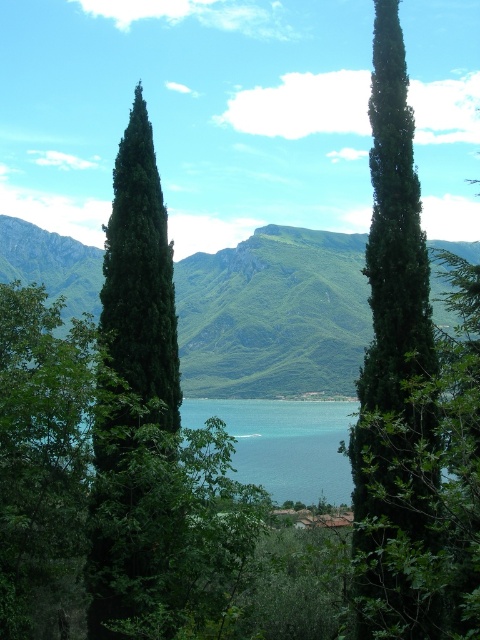
Question: Which object is positioned farthest from the green glossy cypress at center?

Choices:
 (A) green leafy mountain at center
 (B) green matte tree at center

Answer: (A)

Question: Which of the following is the farthest from the observer?

Choices:
 (A) (189, 394)
 (B) (423, 342)

Answer: (A)

Question: Can you confirm if green glossy cypress at center is positioned to the right of green matte tree at center?

Choices:
 (A) no
 (B) yes

Answer: (B)

Question: Observing the image, what is the correct spatial positioning of green leafy mountain at center in reference to green glossy cypress at center?

Choices:
 (A) below
 (B) above

Answer: (B)

Question: Is green glossy cypress at center positioned before green matte tree at center?

Choices:
 (A) yes
 (B) no

Answer: (A)

Question: Which object is positioned farthest from the green matte tree at center?

Choices:
 (A) green leafy mountain at center
 (B) green glossy cypress at center

Answer: (A)